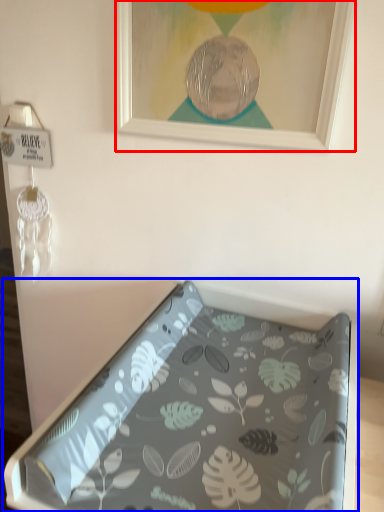
Question: Which point is further to the camera, picture frame (highlighted by a red box) or furniture (highlighted by a blue box)?

Choices:
 (A) picture frame
 (B) furniture

Answer: (A)